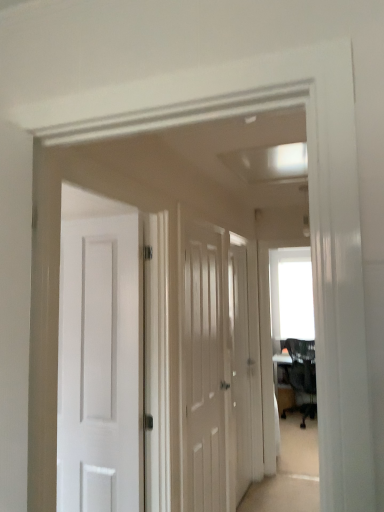
The width and height of the screenshot is (384, 512). Describe the element at coordinates (204, 370) in the screenshot. I see `white wood door at center, the 2th door from the back` at that location.

Find the location of a particular element. black mesh chair at right is located at coordinates (302, 371).

Which point is more distant from viewer, [206,347] or [314,355]?

The point [206,347] is farther from the camera.

Is white wood door at center, which appears as the first door when viewed from the left, turned away from black mesh chair at right?

No, white wood door at center, which appears as the first door when viewed from the left, is not facing away from black mesh chair at right.

Does white wood door at center, the 2th door from the back, have a greater height compared to black mesh chair at right?

Indeed, white wood door at center, the 2th door from the back, has a greater height compared to black mesh chair at right.

Is white wood door at center, which appears as the first door when viewed from the left, positioned beyond the bounds of black mesh chair at right?

Yes, white wood door at center, which appears as the first door when viewed from the left, is outside of black mesh chair at right.

Consider the image. Can you confirm if white wood door at center, the 2th door from the back, is shorter than white wooden door at center, arranged as the 1th door when viewed from the right?

Indeed, white wood door at center, the 2th door from the back, has a lesser height compared to white wooden door at center, arranged as the 1th door when viewed from the right.

Is white wooden door at center, placed as the 1th door when sorted from back to front, a part of white wood door at center, the 2th door from the back?

No, white wooden door at center, placed as the 1th door when sorted from back to front, is located outside of white wood door at center, the 2th door from the back.

Considering the positions of points (223, 470) and (247, 428), is point (223, 470) farther from camera compared to point (247, 428)?

No, (223, 470) is closer to viewer.

Consider the image. How many degrees apart are the facing directions of white wooden door at center, the second door viewed from the front, and black mesh chair at right?

white wooden door at center, the second door viewed from the front, and black mesh chair at right are facing 90.3 degrees away from each other.

Is point (243, 369) more distant than point (292, 342)?

That is False.

Does white wooden door at center, the second door viewed from the front, turn towards black mesh chair at right?

No, white wooden door at center, the second door viewed from the front, does not turn towards black mesh chair at right.

Between white wooden door at center, placed as the 1th door when sorted from back to front, and black mesh chair at right, which one has less height?

With less height is black mesh chair at right.

From the image's perspective, is black mesh chair at right located above white wooden door at center, placed as the 1th door when sorted from back to front?

Actually, black mesh chair at right appears below white wooden door at center, placed as the 1th door when sorted from back to front, in the image.

Between black mesh chair at right and white wooden door at center, the second door viewed from the front, which one appears on the right side from the viewer's perspective?

black mesh chair at right.

Does point (288, 342) appear closer or farther from the camera than point (246, 304)?

Point (288, 342) is farther from the camera than point (246, 304).

Which of these two, black mesh chair at right or white wooden door at center, the second door viewed from the left, stands shorter?

With less height is black mesh chair at right.

Is black mesh chair at right taller or shorter than white wood door at center, the second door positioned from the right?

black mesh chair at right is shorter than white wood door at center, the second door positioned from the right.

Between black mesh chair at right and white wood door at center, the 2th door from the back, which one is positioned behind?

black mesh chair at right is more distant.

I want to click on chair that appears on the right of white wood door at center, the second door positioned from the right, so click(x=302, y=371).

Can you confirm if black mesh chair at right is smaller than white wood door at center, which ranks as the 1th door in front-to-back order?

Actually, black mesh chair at right might be larger than white wood door at center, which ranks as the 1th door in front-to-back order.

Can white wood door at center, the second door positioned from the right, be found inside white wooden door at center, placed as the 1th door when sorted from back to front?

No.

Between white wooden door at center, placed as the 1th door when sorted from back to front, and white wood door at center, which appears as the first door when viewed from the left, which one has smaller width?

Thinner between the two is white wooden door at center, placed as the 1th door when sorted from back to front.

Locate an element on the screen. Image resolution: width=384 pixels, height=512 pixels. door positioned vertically above the white wooden door at center, placed as the 1th door when sorted from back to front (from a real-world perspective) is located at coordinates (204, 370).

Between point (241, 370) and point (193, 417), which one is positioned in front?

The point (193, 417) is more forward.

Starting from the black mesh chair at right, which door is the 2nd one in front? Please provide its 2D coordinates.

[(204, 370)]

In the image, there is a white wood door at center, which ranks as the 1th door in front-to-back order. Identify the location of door below it (from a real-world perspective). Image resolution: width=384 pixels, height=512 pixels. (240, 367).

Looking at the image, which one is located closer to white wooden door at center, the second door viewed from the front, white wood door at center, which ranks as the 1th door in front-to-back order, or black mesh chair at right?

white wood door at center, which ranks as the 1th door in front-to-back order, is closer to white wooden door at center, the second door viewed from the front.

Which object lies further to the anchor point white wood door at center, the second door positioned from the right, white wooden door at center, the second door viewed from the front, or black mesh chair at right?

black mesh chair at right is positioned further to the anchor white wood door at center, the second door positioned from the right.

From the image, which object appears to be farther from white wooden door at center, placed as the 1th door when sorted from back to front, black mesh chair at right or white wood door at center, the second door positioned from the right?

black mesh chair at right is further to white wooden door at center, placed as the 1th door when sorted from back to front.

When comparing their distances from black mesh chair at right, does white wood door at center, the second door positioned from the right, or white wooden door at center, placed as the 1th door when sorted from back to front, seem closer?

Among the two, white wooden door at center, placed as the 1th door when sorted from back to front, is located nearer to black mesh chair at right.

When comparing their distances from white wood door at center, which appears as the first door when viewed from the left, does black mesh chair at right or white wooden door at center, the second door viewed from the front, seem further?

black mesh chair at right lies further to white wood door at center, which appears as the first door when viewed from the left, than the other object.

Looking at the image, which one is located further to black mesh chair at right, white wooden door at center, placed as the 1th door when sorted from back to front, or white wood door at center, which appears as the first door when viewed from the left?

white wood door at center, which appears as the first door when viewed from the left.

Image resolution: width=384 pixels, height=512 pixels. What are the coordinates of `door located between white wood door at center, which ranks as the 1th door in front-to-back order, and black mesh chair at right in the depth direction` in the screenshot? It's located at (240, 367).